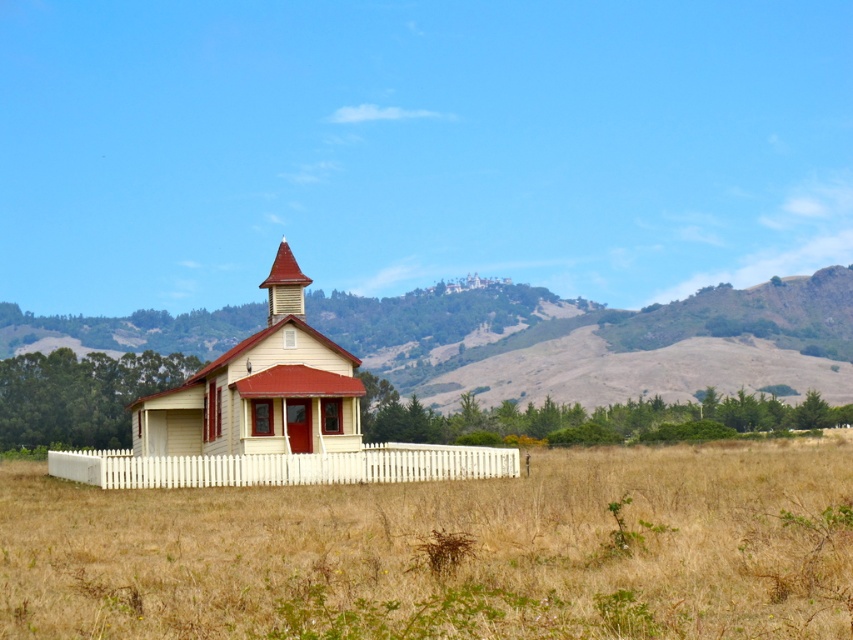
Question: Which object is farther from the camera taking this photo?

Choices:
 (A) rugged brown hillside at center
 (B) light yellow wood church at center

Answer: (A)

Question: Which point is farther from the camera taking this photo?

Choices:
 (A) (695, 300)
 (B) (689, 467)
 (C) (289, 276)

Answer: (A)

Question: Does light yellow wood church at center have a lesser width compared to shiny red wood spire at center?

Choices:
 (A) yes
 (B) no

Answer: (B)

Question: Which is farther from the rugged brown hillside at center?

Choices:
 (A) dry grass at center
 (B) shiny red wood spire at center

Answer: (B)

Question: Is dry grass at center smaller than rugged brown hillside at center?

Choices:
 (A) yes
 (B) no

Answer: (A)

Question: Is dry grass at center in front of shiny red wood spire at center?

Choices:
 (A) no
 (B) yes

Answer: (B)